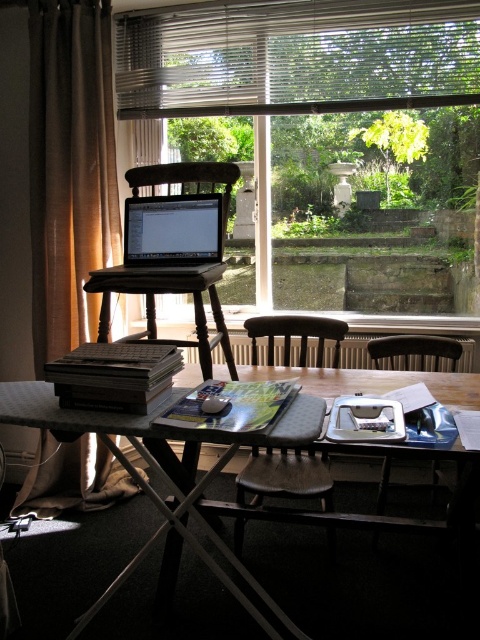
You are setting up a desk in the room and want to place a new monitor between the wooden table at center and the satin black laptop at center. Based on their positions, where should the monitor be placed?

The wooden table at center is located below the satin black laptop at center, so the monitor should be placed above the wooden table at center to align with the laptop.

You are setting up a desk in the room and want to place a new monitor to the left of the satin black laptop at center. Is there enough space on the wooden table at center for the monitor?

The wooden table at center is positioned on the right side of the satin black laptop at center, so there is space to the left of the laptop. Therefore, the monitor can be placed there.

You are a person who is 1.7 meters tall and want to sit on the dark wood chair at center to work on the laptop. Can you comfortably reach the metallic blinds at upper center to adjust them without standing up?

The metallic blinds at upper center are 1.97 meters from the dark wood chair at center. Since the person is 1.7 meters tall, they would need to stretch to reach the blinds but might still manage without standing up, depending on their arm length and flexibility.